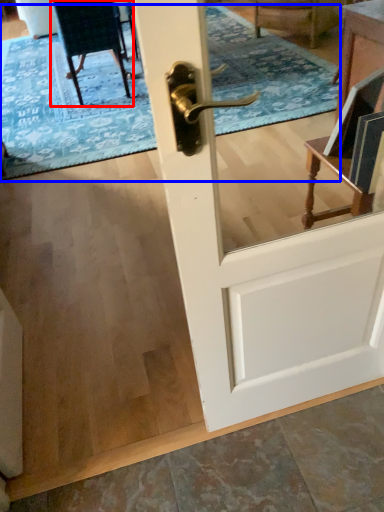
Question: Which object appears farthest to the camera in this image, chair (highlighted by a red box) or doormat (highlighted by a blue box)?

Choices:
 (A) chair
 (B) doormat

Answer: (A)